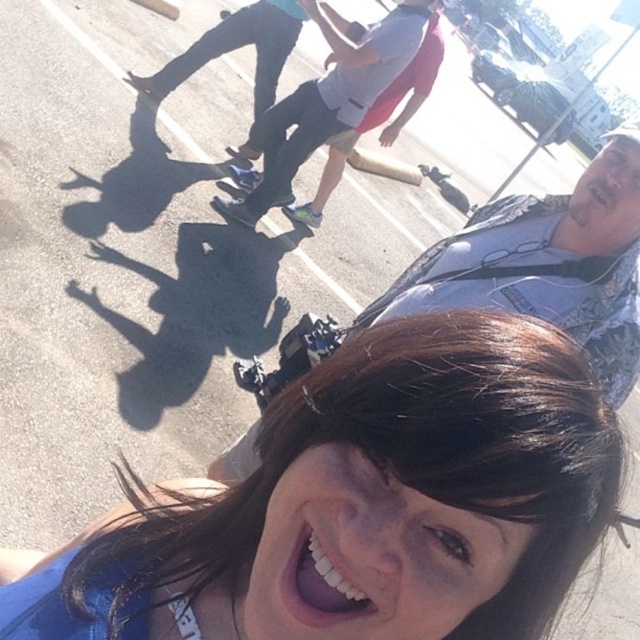
Question: Does blue fabric at lower left have a larger size compared to matte black skateboard at center?

Choices:
 (A) yes
 (B) no

Answer: (B)

Question: Which object is farther from the camera taking this photo?

Choices:
 (A) blue fabric at lower left
 (B) matte black skateboard at center

Answer: (B)

Question: Can you confirm if matte black skateboard at center is wider than white matte skateboard at center?

Choices:
 (A) no
 (B) yes

Answer: (A)

Question: Among these objects, which one is farthest from the camera?

Choices:
 (A) blue fabric at lower left
 (B) matte black skateboard at center

Answer: (B)

Question: Can you confirm if white matte skateboard at center is positioned to the right of white glossy teeth at lower center?

Choices:
 (A) no
 (B) yes

Answer: (A)

Question: Among these points, which one is farthest from the camera?

Choices:
 (A) (349, 589)
 (B) (385, 317)
 (C) (586, 369)
 (D) (307, 129)

Answer: (D)